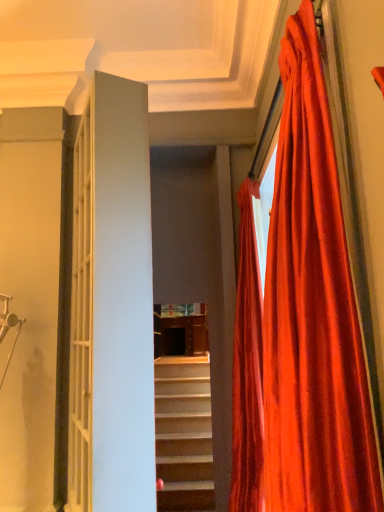
What do you see at coordinates (318, 298) in the screenshot?
I see `satin red curtain at right` at bounding box center [318, 298].

What is the approximate height of satin red curtain at right?

satin red curtain at right is 1.48 meters in height.

The width and height of the screenshot is (384, 512). I want to click on satin red curtain at right, so click(318, 298).

Find the location of a particular element. satin red curtain at right is located at coordinates (318, 298).